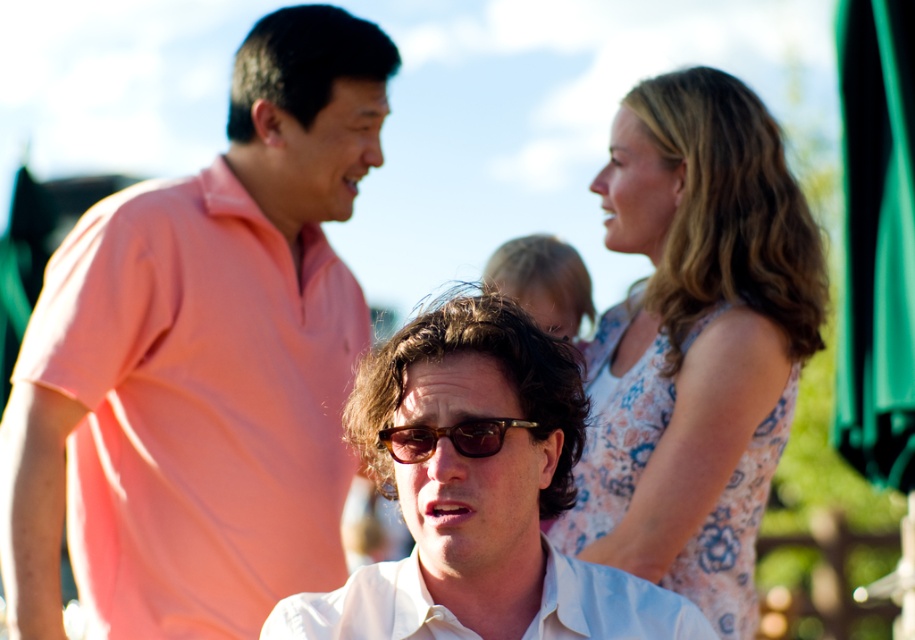
Question: Does pink cotton shirt at left appear under brown tortoiseshell sunglasses at center?

Choices:
 (A) no
 (B) yes

Answer: (A)

Question: Which object is the closest to the brown tortoiseshell sunglasses at center?

Choices:
 (A) floral dress at upper right
 (B) white cotton shirt at center
 (C) pink cotton shirt at left
 (D) blonde hair at center

Answer: (B)

Question: Which of the following is the closest to the observer?

Choices:
 (A) (413, 620)
 (B) (493, 513)
 (C) (460, 444)
 (D) (230, 195)

Answer: (C)

Question: Which point is farther to the camera?

Choices:
 (A) (652, 397)
 (B) (425, 634)
 (C) (421, 451)
 (D) (131, 209)

Answer: (D)

Question: Is pink cotton shirt at left wider than matte white shirt at center?

Choices:
 (A) yes
 (B) no

Answer: (A)

Question: Does matte white shirt at center have a lesser width compared to blonde hair at center?

Choices:
 (A) yes
 (B) no

Answer: (B)